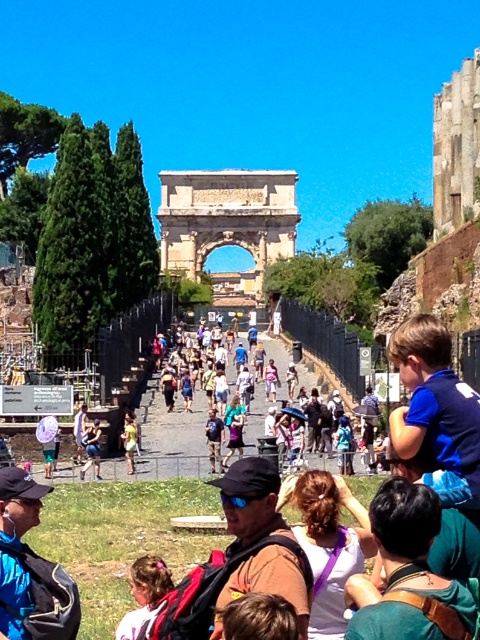
Question: Is white fabric at center smaller than pink hair at lower left?

Choices:
 (A) yes
 (B) no

Answer: (B)

Question: Which point is closer to the camera?

Choices:
 (A) denim shorts at center
 (B) blue denim jeans at center
 (C) white fabric at center
 (D) pink hair at lower left

Answer: (C)

Question: Can you confirm if green fabric shirt at lower right is wider than white fabric at center?

Choices:
 (A) no
 (B) yes

Answer: (B)

Question: Which point is farther to the camera?

Choices:
 (A) green fabric shirt at lower right
 (B) white fabric at center

Answer: (B)

Question: Can you confirm if pink hair at lower left is positioned below blue denim jeans at center?

Choices:
 (A) yes
 (B) no

Answer: (A)

Question: Among these points, which one is nearest to the camera?

Choices:
 (A) (420, 532)
 (B) (134, 595)
 (C) (90, 448)

Answer: (A)